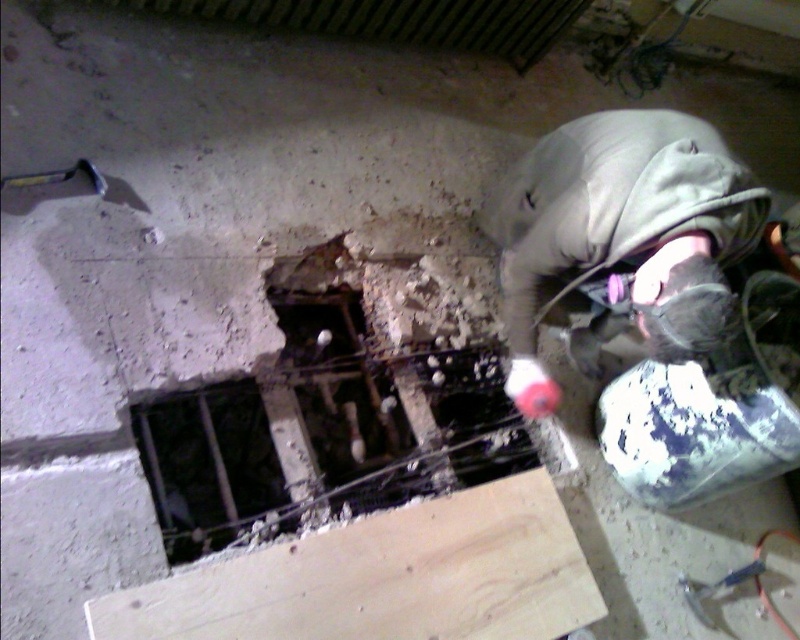
Does light brown wood plank at lower center have a lesser height compared to dark metal bars at center?

Yes, light brown wood plank at lower center is shorter than dark metal bars at center.

Can you confirm if light brown wood plank at lower center is wider than dark metal bars at center?

Correct, the width of light brown wood plank at lower center exceeds that of dark metal bars at center.

This screenshot has width=800, height=640. What do you see at coordinates (384, 577) in the screenshot?
I see `light brown wood plank at lower center` at bounding box center [384, 577].

Where is `light brown wood plank at lower center`? This screenshot has width=800, height=640. light brown wood plank at lower center is located at coordinates [384, 577].

Does light brown wood plank at lower center have a greater height compared to gray fabric construction worker at upper right?

No.

Is light brown wood plank at lower center to the right of gray fabric construction worker at upper right from the viewer's perspective?

No, light brown wood plank at lower center is not to the right of gray fabric construction worker at upper right.

What do you see at coordinates (384, 577) in the screenshot?
I see `light brown wood plank at lower center` at bounding box center [384, 577].

You are a GUI agent. You are given a task and a screenshot of the screen. Output one action in this format:
    pyautogui.click(x=<x>, y=<y>)
    Task: Click on the light brown wood plank at lower center
    
    Given the screenshot: What is the action you would take?
    pyautogui.click(x=384, y=577)

Who is higher up, gray fabric construction worker at upper right or dark metal bars at center?

gray fabric construction worker at upper right

Can you confirm if gray fabric construction worker at upper right is positioned to the left of dark metal bars at center?

Incorrect, gray fabric construction worker at upper right is not on the left side of dark metal bars at center.

Which is behind, point (604, 138) or point (225, 440)?

Positioned behind is point (225, 440).

What are the coordinates of `gray fabric construction worker at upper right` in the screenshot? It's located at (624, 228).